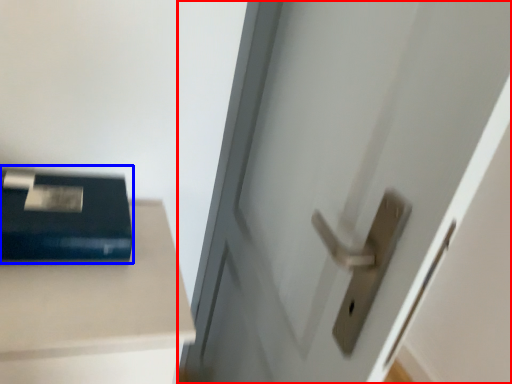
Question: Which object is further to the camera taking this photo, door (highlighted by a red box) or paperback book (highlighted by a blue box)?

Choices:
 (A) door
 (B) paperback book

Answer: (B)